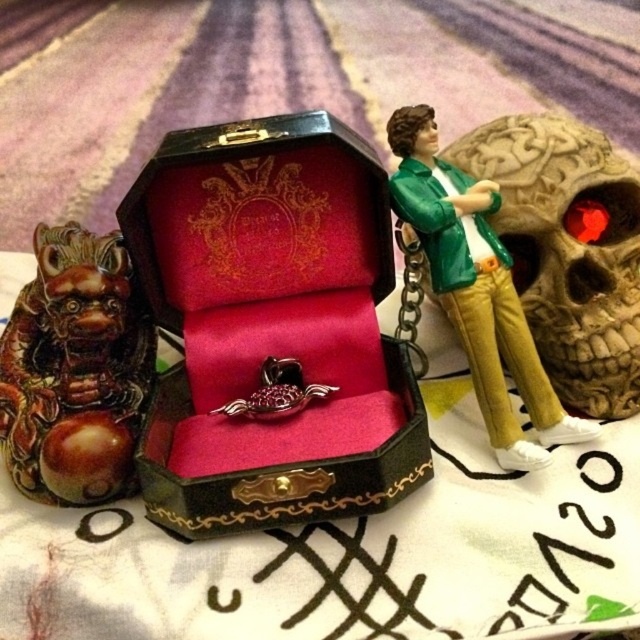
You are a collector who wants to take a closer look at the matte brown skull at right. If your hand is 12 inches long, can you reach it from where you are standing?

The distance between the matte brown skull at right and the camera is 37.87 inches. Since your hand is only 12 inches long, you cannot reach the matte brown skull at right from your current position.

You are an interior designer arranging items on a shelf. You have a matte brown skull at right and a metallic gold chain at center. Which object is closer to the viewer?

The matte brown skull at right is closer to the viewer because the metallic gold chain at center is behind it.